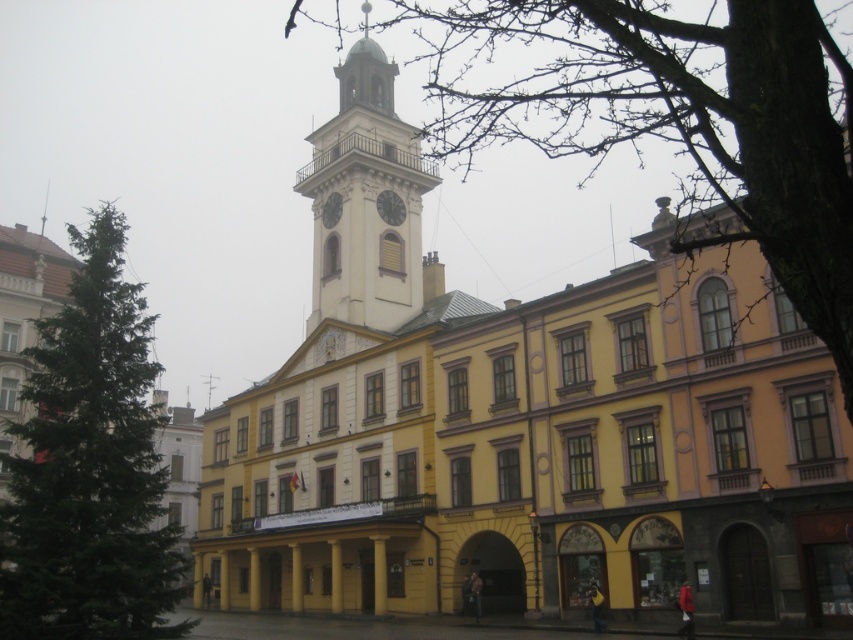
Question: Estimate the real-world distances between objects in this image. Which object is closer to the bare wood tree at upper center?

Choices:
 (A) green textured tree at left
 (B) white stone clock tower at center
 (C) matte white clock at center

Answer: (B)

Question: Does bare wood tree at upper center appear over green textured tree at left?

Choices:
 (A) yes
 (B) no

Answer: (A)

Question: Does bare wood tree at upper center appear on the left side of white stone clock tower at center?

Choices:
 (A) no
 (B) yes

Answer: (A)

Question: Based on their relative distances, which object is nearer to the green textured tree at left?

Choices:
 (A) matte white clock at center
 (B) bare wood tree at upper center

Answer: (B)

Question: Is bare wood tree at upper center bigger than matte white clock at center?

Choices:
 (A) yes
 (B) no

Answer: (A)

Question: Among these points, which one is farthest from the camera?

Choices:
 (A) (370, 83)
 (B) (111, 584)
 (C) (402, 208)

Answer: (A)